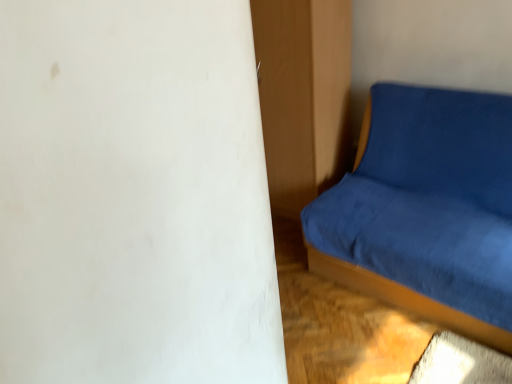
Question: Is blue fabric studio couch at right bigger or smaller than matte wood dresser at center?

Choices:
 (A) small
 (B) big

Answer: (B)

Question: From a real-world perspective, is blue fabric studio couch at right above or below matte wood dresser at center?

Choices:
 (A) above
 (B) below

Answer: (B)

Question: Considering their positions, is blue fabric studio couch at right located in front of or behind matte wood dresser at center?

Choices:
 (A) front
 (B) behind

Answer: (A)

Question: Relative to blue fabric studio couch at right, is matte wood dresser at center in front or behind?

Choices:
 (A) behind
 (B) front

Answer: (A)

Question: From the image's perspective, is matte wood dresser at center located above or below blue fabric studio couch at right?

Choices:
 (A) below
 (B) above

Answer: (B)

Question: Looking at their shapes, would you say matte wood dresser at center is wider or thinner than blue fabric studio couch at right?

Choices:
 (A) wide
 (B) thin

Answer: (B)

Question: In terms of size, does matte wood dresser at center appear bigger or smaller than blue fabric studio couch at right?

Choices:
 (A) small
 (B) big

Answer: (A)